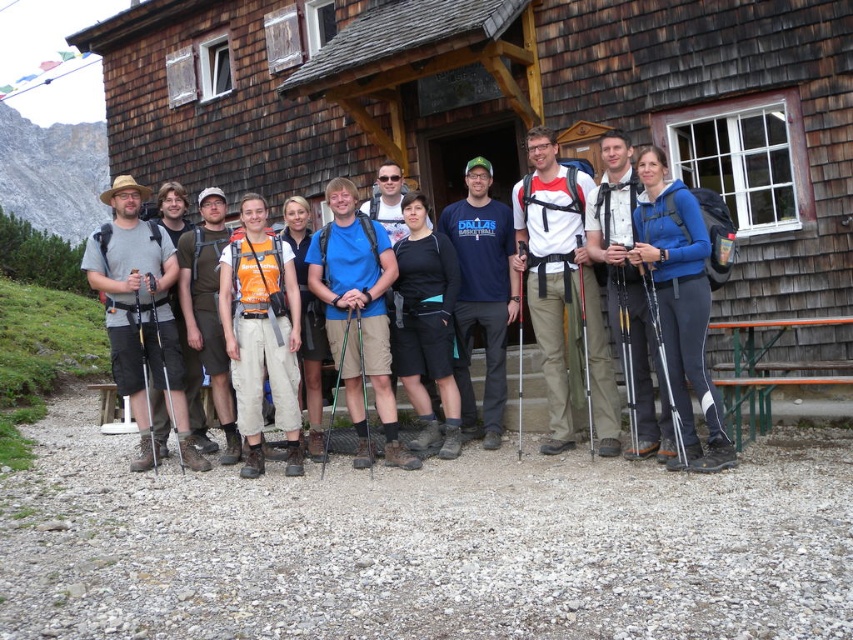
You are standing in front of the rustic wooden building and want to take a photo of both the point at coordinates (670, 465) and the point at coordinates (277, 253). Which point will appear larger in your photo?

The point at coordinates (670, 465) will appear larger in the photo because it is closer to the camera than the point at coordinates (277, 253).

You are a hiker standing at the mountain lodge and need to locate two specific points marked on a map. The first point is at coordinates point (253, 396), and the second point is at point (465, 330). According to the scene, which point is closer to you?

Point (253, 396) is in front of point (465, 330), so the first point is closer to you.